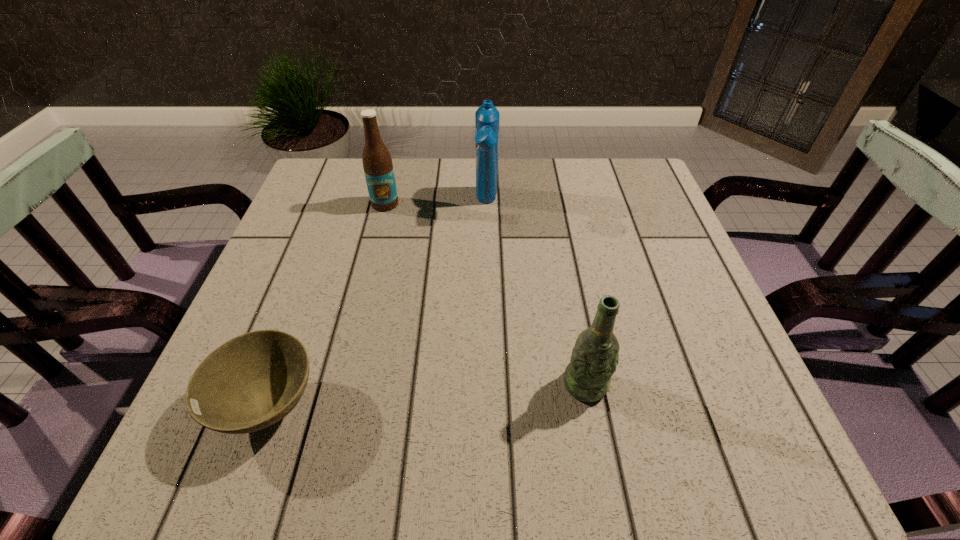
Locate an element on the screen. shampoo is located at coordinates (487, 117).

The image size is (960, 540). In order to click on the farther beer bottle in this screenshot , I will do `click(378, 168)`.

Identify the location of the nearer beer bottle. This screenshot has width=960, height=540. pyautogui.click(x=587, y=378).

This screenshot has width=960, height=540. What are the coordinates of `the rightmost object` in the screenshot? It's located at (587, 378).

Identify the location of the shortest object. This screenshot has height=540, width=960. (254, 380).

You are a GUI agent. You are given a task and a screenshot of the screen. Output one action in this format:
    pyautogui.click(x=<x>, y=<y>)
    Task: Click on the vacant space situated on the front of the shampoo
    
    Given the screenshot: What is the action you would take?
    pyautogui.click(x=489, y=337)

Where is `blank space located on the left of the left beer bottle`? blank space located on the left of the left beer bottle is located at coordinates [336, 204].

Where is `vacant space located 0.060m on the surface of the nearer beer bottle`? The image size is (960, 540). vacant space located 0.060m on the surface of the nearer beer bottle is located at coordinates (596, 440).

Where is `vacant space located on the back of the shortest object`? The height and width of the screenshot is (540, 960). vacant space located on the back of the shortest object is located at coordinates (x=316, y=277).

I want to click on shampoo that is at the far edge, so click(487, 117).